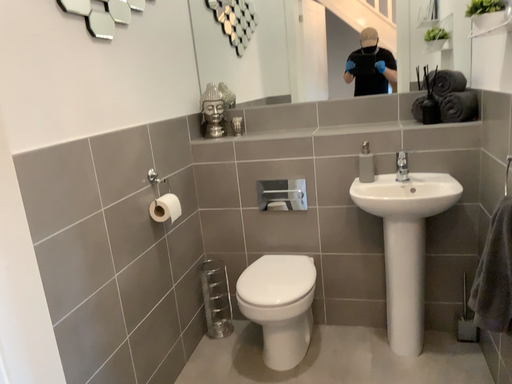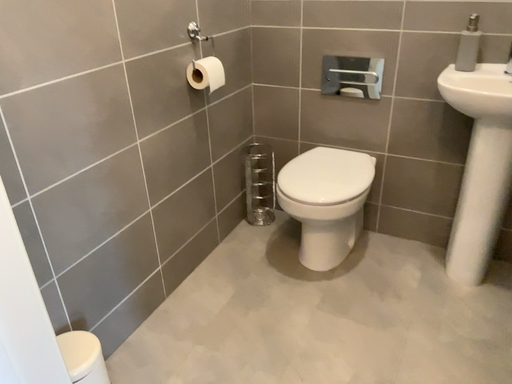
Question: How did the camera likely rotate when shooting the video?

Choices:
 (A) rotated downward
 (B) rotated upward

Answer: (A)